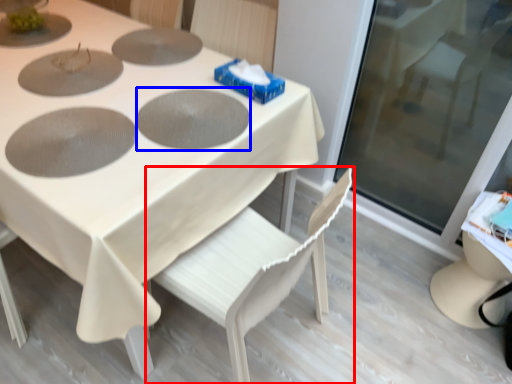
Question: Which object appears closest to the camera in this image, chair (highlighted by a red box) or pizza pan (highlighted by a blue box)?

Choices:
 (A) chair
 (B) pizza pan

Answer: (A)